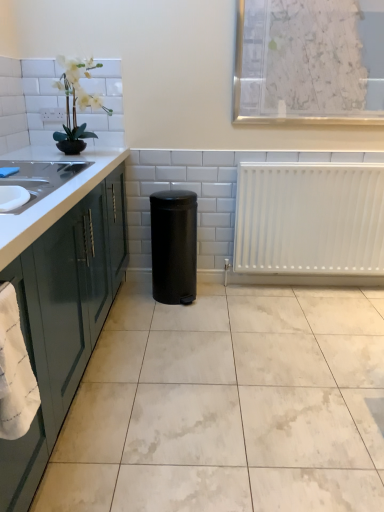
At what (x,y) coordinates should I click in order to perform the action: click on green glossy cabinetry at left. Please return your answer as a coordinate pair (x, y). This screenshot has height=512, width=384. Looking at the image, I should click on (63, 320).

Describe the element at coordinates (305, 61) in the screenshot. I see `white textured paper at upper center` at that location.

Where is `white glossy countertop at left`? The width and height of the screenshot is (384, 512). white glossy countertop at left is located at coordinates click(x=53, y=195).

Consider the image. Can you confirm if white textured paper at upper center is taller than black matte trash can at center?

In fact, white textured paper at upper center may be shorter than black matte trash can at center.

Is white textured paper at upper center inside the boundaries of black matte trash can at center, or outside?

white textured paper at upper center is located beyond the bounds of black matte trash can at center.

Is point (253, 85) closer or farther from the camera than point (165, 212)?

Clearly, point (253, 85) is more distant from the camera than point (165, 212).

Is white textured paper at upper center closer to the viewer compared to black matte trash can at center?

Yes, it is.

Is white glossy countertop at left not close to white artificial plant at upper left?

No, white glossy countertop at left is not far from white artificial plant at upper left.

Looking at the image, does white glossy countertop at left seem bigger or smaller compared to white artificial plant at upper left?

Clearly, white glossy countertop at left is larger in size than white artificial plant at upper left.

Considering the relative positions of white glossy countertop at left and white artificial plant at upper left in the image provided, is white glossy countertop at left to the right of white artificial plant at upper left from the viewer's perspective?

Incorrect, white glossy countertop at left is not on the right side of white artificial plant at upper left.

From a real-world perspective, is white glossy countertop at left under white artificial plant at upper left?

Indeed, from a real-world perspective, white glossy countertop at left is positioned beneath white artificial plant at upper left.

Does white artificial plant at upper left have a greater width compared to white textured paper at upper center?

Yes, white artificial plant at upper left is wider than white textured paper at upper center.

Consider the image. Based on their sizes in the image, would you say white artificial plant at upper left is bigger or smaller than white textured paper at upper center?

white artificial plant at upper left is bigger than white textured paper at upper center.

Is white artificial plant at upper left not within white textured paper at upper center?

Yes, white artificial plant at upper left is not within white textured paper at upper center.

From the image's perspective, does white artificial plant at upper left appear higher than white textured paper at upper center?

No.

From a real-world perspective, does green glossy cabinetry at left stand above white matte radiator at right?

Actually, green glossy cabinetry at left is physically below white matte radiator at right in the real world.

Could you tell me if green glossy cabinetry at left is turned towards white matte radiator at right?

Yes, green glossy cabinetry at left is oriented towards white matte radiator at right.

Relative to white matte radiator at right, is green glossy cabinetry at left in front or behind?

green glossy cabinetry at left is positioned closer to the viewer than white matte radiator at right.

Are green glossy cabinetry at left and white matte radiator at right beside each other?

green glossy cabinetry at left and white matte radiator at right are clearly separated.

Is white marble floor at center in front of black matte trash can at center?

Yes, it is in front of black matte trash can at center.

Would you say white marble floor at center contains black matte trash can at center?

No, black matte trash can at center is not surrounded by white marble floor at center.

Is white marble floor at center facing towards black matte trash can at center?

No, white marble floor at center is not oriented towards black matte trash can at center.

From the image's perspective, between white marble floor at center and black matte trash can at center, which one is located above?

black matte trash can at center.

Is black matte trash can at center oriented away from white artificial plant at upper left?

black matte trash can at center does not have its back to white artificial plant at upper left.

Which is correct: black matte trash can at center is inside white artificial plant at upper left, or outside of it?

black matte trash can at center cannot be found inside white artificial plant at upper left.

I want to click on appliance behind the white artificial plant at upper left, so click(174, 246).

From the image's perspective, does black matte trash can at center appear lower than white artificial plant at upper left?

Indeed, from the image's perspective, black matte trash can at center is shown beneath white artificial plant at upper left.

From a real-world perspective, which object stands above the other?

white glossy countertop at left, from a real-world perspective.

From the image's perspective, would you say white marble floor at center is positioned over white glossy countertop at left?

Incorrect, from the image's perspective, white marble floor at center is lower than white glossy countertop at left.

Is white marble floor at center facing towards white glossy countertop at left?

No, white marble floor at center is not turned towards white glossy countertop at left.

Does white marble floor at center have a greater height compared to white glossy countertop at left?

No.

The image size is (384, 512). In order to click on window screen located above the black matte trash can at center (from a real-world perspective) in this screenshot , I will do `click(305, 61)`.

This screenshot has height=512, width=384. I want to click on houseplant above the white glossy countertop at left (from the image's perspective), so click(75, 104).

Based on their spatial positions, is white marble floor at center or green glossy cabinetry at left further from white matte radiator at right?

Based on the image, green glossy cabinetry at left appears to be further to white matte radiator at right.

When comparing their distances from white textured paper at upper center, does green glossy cabinetry at left or white artificial plant at upper left seem further?

green glossy cabinetry at left is positioned further to the anchor white textured paper at upper center.

Based on their spatial positions, is white textured paper at upper center or white marble floor at center further from white artificial plant at upper left?

white marble floor at center.

Looking at the image, which one is located further to white glossy countertop at left, green glossy cabinetry at left or white textured paper at upper center?

The object further to white glossy countertop at left is white textured paper at upper center.

In the scene shown: Based on their spatial positions, is white glossy countertop at left or black matte trash can at center closer to white artificial plant at upper left?

white glossy countertop at left.

Looking at the image, which one is located further to white marble floor at center, white glossy countertop at left or white artificial plant at upper left?

Based on the image, white artificial plant at upper left appears to be further to white marble floor at center.

Which object lies further to the anchor point white artificial plant at upper left, green glossy cabinetry at left or white glossy countertop at left?

green glossy cabinetry at left.

When comparing their distances from green glossy cabinetry at left, does black matte trash can at center or white marble floor at center seem closer?

Based on the image, white marble floor at center appears to be nearer to green glossy cabinetry at left.

This screenshot has width=384, height=512. I want to click on radiator that lies between white textured paper at upper center and black matte trash can at center from top to bottom, so click(x=309, y=218).

At what (x,y) coordinates should I click in order to perform the action: click on ceramic tile between green glossy cabinetry at left and black matte trash can at center from front to back. Please return your answer as a coordinate pair (x, y). This screenshot has height=512, width=384. Looking at the image, I should click on (228, 405).

I want to click on cabinetry between white artificial plant at upper left and white marble floor at center in the vertical direction, so click(x=63, y=320).

Find the location of a particular element. The height and width of the screenshot is (512, 384). appliance between white artificial plant at upper left and white marble floor at center from top to bottom is located at coordinates (174, 246).